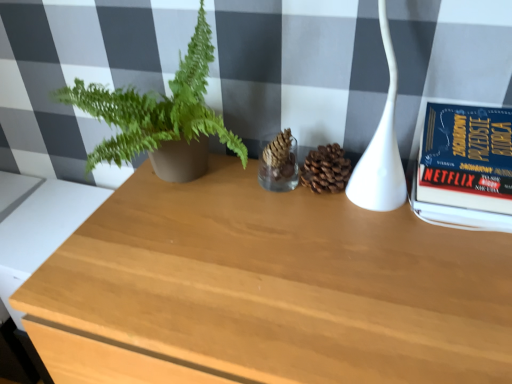
Locate an element on the screen. free region on the left part of hardcover book at right is located at coordinates (384, 243).